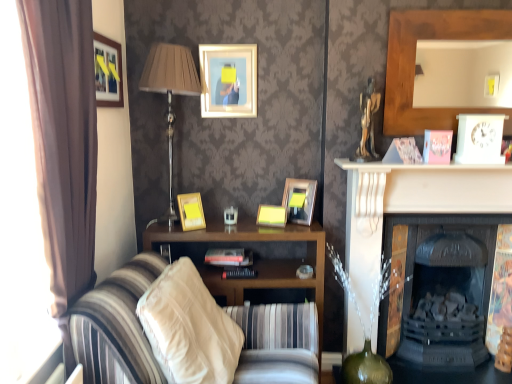
Question: From a real-world perspective, relative to beige fabric pillow at lower center, is yellow matte picture frame at center, the fourth picture frame positioned from the left, vertically above or below?

Choices:
 (A) above
 (B) below

Answer: (A)

Question: Is yellow matte picture frame at center, the second picture frame positioned from the right, spatially inside beige fabric pillow at lower center, or outside of it?

Choices:
 (A) inside
 (B) outside

Answer: (B)

Question: Which is farther from the matte gold picture frame at upper left, which is the first picture frame in left-to-right order?

Choices:
 (A) metallic silver table lamp at left
 (B) brown fabric curtain at left
 (C) hardcover book at center
 (D) matte gold picture frame at center, the fifth picture frame positioned from the left
 (E) beige fabric pillow at lower center

Answer: (D)

Question: Which object is the farthest from the matte gold picture frame at center, which is the first picture frame from right to left?

Choices:
 (A) striped fabric couch at center
 (B) beige fabric pillow at lower center
 (C) matte yellow picture frame at center, the 4th picture frame in the right-to-left sequence
 (D) yellow matte picture frame at center, the fourth picture frame positioned from the left
 (E) metallic silver table lamp at left

Answer: (A)